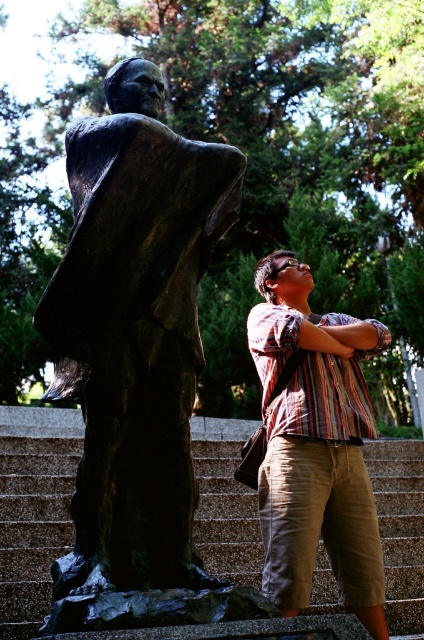
You are standing in a park and see the bronze statue at left. If you want to take a photo of it, where should you position yourself to ensure it fits in the frame?

To take a photo of the bronze statue at left, position yourself at point (x=136, y=342) to ensure it fits in the frame.

You are standing in a park and see the bronze statue at left. If you want to take a photo of it from the front, which direction should you face?

The bronze statue at left is positioned at point (136, 342), so you should face towards the left side of the park to capture it from the front.

You are a tour guide explaining the layout of the park to a group. You mention the bronze statue at left and the granite stairs at center. Which object is bigger in size?

The bronze statue at left has a smaller size compared to granite stairs at center, so the granite stairs at center are bigger in size.